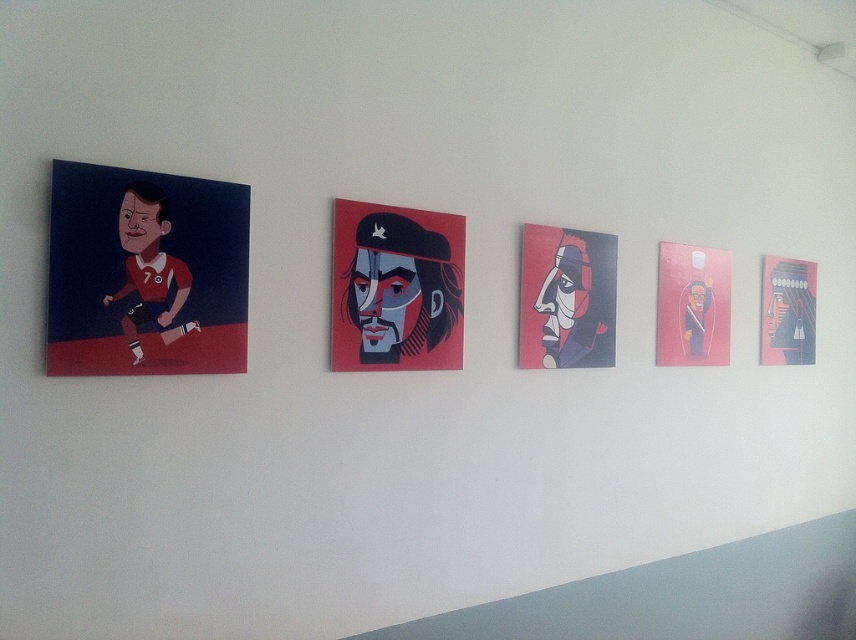
Question: Which of these objects is positioned closest to the pink matte painting at right?

Choices:
 (A) matte black accordion at right
 (B) matte black mask at center
 (C) matte red shirt at left

Answer: (A)

Question: Is matte black mask at center smaller than matte black accordion at right?

Choices:
 (A) no
 (B) yes

Answer: (A)

Question: Is matte red shirt at left smaller than matte black accordion at right?

Choices:
 (A) yes
 (B) no

Answer: (A)

Question: Which object is closer to the camera taking this photo?

Choices:
 (A) matte red portrait at center
 (B) matte black accordion at right
 (C) matte red shirt at left
 (D) pink matte painting at right

Answer: (C)

Question: Does matte red shirt at left appear on the right side of pink matte painting at right?

Choices:
 (A) yes
 (B) no

Answer: (B)

Question: Which point appears closest to the camera in this image?

Choices:
 (A) (137, 282)
 (B) (670, 330)
 (C) (443, 328)

Answer: (A)